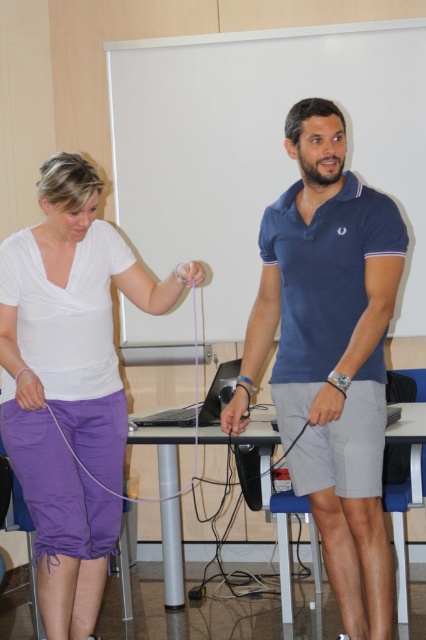
Between blue cotton polo shirt at center and purple fabric hand at lower left, which one appears on the left side from the viewer's perspective?

From the viewer's perspective, purple fabric hand at lower left appears more on the left side.

Who is positioned more to the right, blue cotton polo shirt at center or purple fabric hand at lower left?

blue cotton polo shirt at center

Image resolution: width=426 pixels, height=640 pixels. Describe the element at coordinates (331, 352) in the screenshot. I see `blue cotton polo shirt at center` at that location.

Find the location of a particular element. The height and width of the screenshot is (640, 426). blue cotton polo shirt at center is located at coordinates (331, 352).

Can you confirm if matte white shirt at center is bigger than navy blue polo shirt at center?

Correct, matte white shirt at center is larger in size than navy blue polo shirt at center.

Between matte white shirt at center and navy blue polo shirt at center, which one is positioned higher?

navy blue polo shirt at center is above.

Which is in front, point (51, 392) or point (305, 278)?

Point (305, 278) is more forward.

Find the location of a particular element. Image resolution: width=426 pixels, height=640 pixels. matte white shirt at center is located at coordinates (69, 384).

Who is shorter, navy blue polo shirt at center or matte purple cord at center?

matte purple cord at center

Is point (301, 244) positioned after point (193, 260)?

No, it is in front of (193, 260).

Locate an element on the screen. navy blue polo shirt at center is located at coordinates (325, 272).